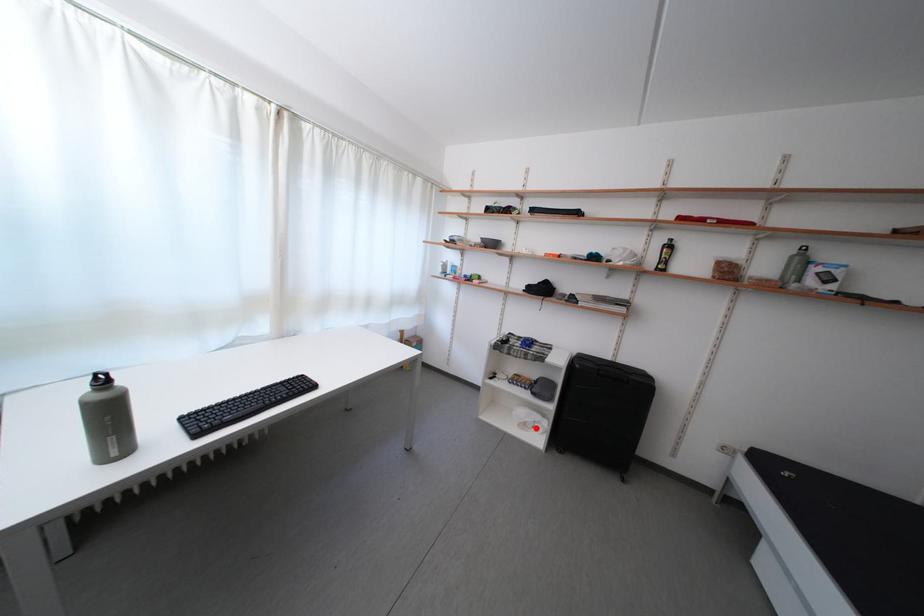
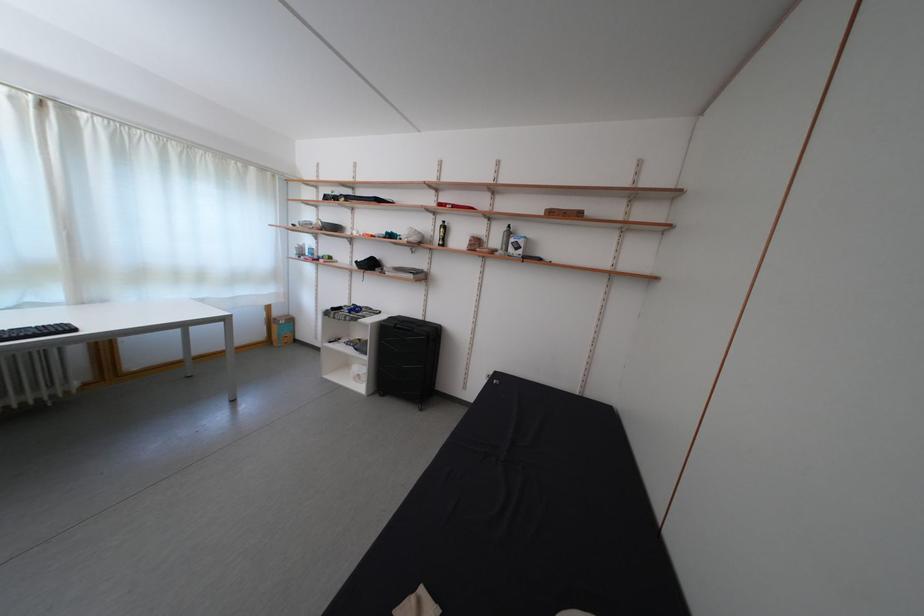
In the second image, find the point that corresponds to the highlighted location in the first image.

(365, 381)